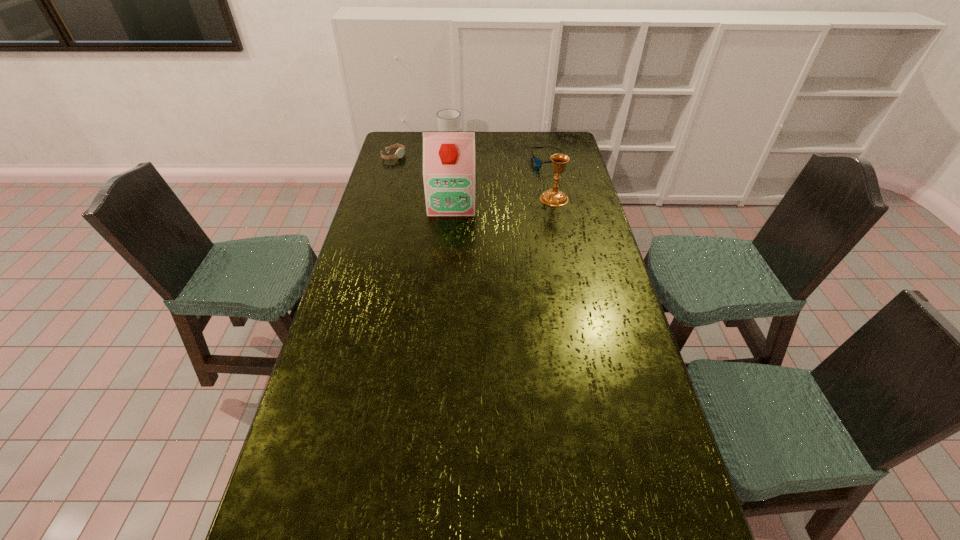
Find the location of `free space on the desktop that is between the soya milk and the fourth shortest object and is positioned with a handle on the side of the third shortest object`. free space on the desktop that is between the soya milk and the fourth shortest object and is positioned with a handle on the side of the third shortest object is located at coordinates (516, 200).

The image size is (960, 540). I want to click on vacant space on the desktop that is between the tallest object and the chalice and is positioned on the face of the watch, so click(501, 200).

Locate an element on the screen. The height and width of the screenshot is (540, 960). vacant spot on the desktop that is between the soya milk and the chalice and is positioned at the front of the shortest object showing the lenses is located at coordinates (492, 201).